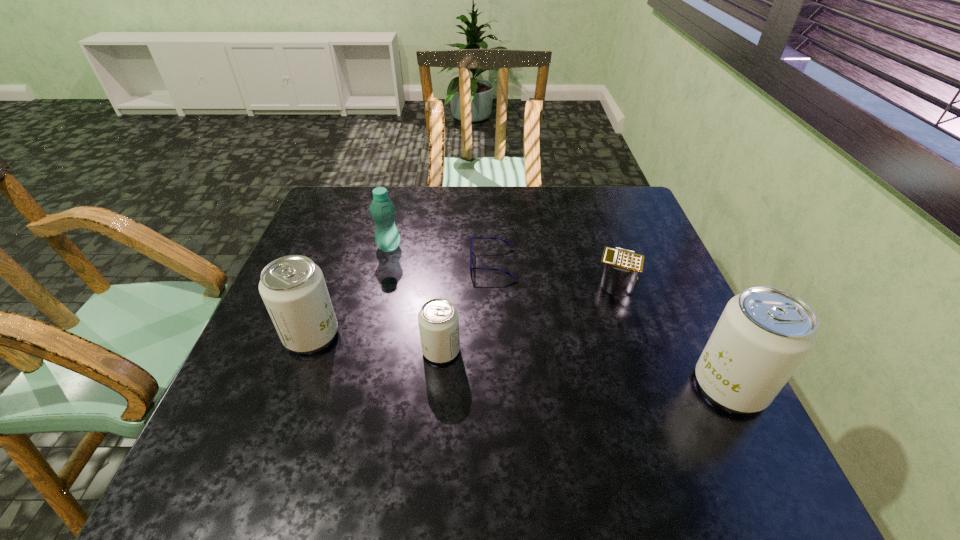
You are a GUI agent. You are given a task and a screenshot of the screen. Output one action in this format:
    pyautogui.click(x=<x>, y=<y>)
    Task: Click on the soda can that can be found as the third closest to the fifth object from right to left
    The height and width of the screenshot is (540, 960).
    Given the screenshot: What is the action you would take?
    point(764,333)

Locate an element on the screen. blank space that satisfies the following two spatial constraints: 1. on the front-facing side of the spectacles; 2. on the front side of the leftmost object is located at coordinates tap(495, 335).

Locate an element on the screen. This screenshot has height=540, width=960. blank area in the image that satisfies the following two spatial constraints: 1. on the back side of the calculator; 2. on the front-facing side of the third object from right to left is located at coordinates (610, 264).

Where is `free location that satisfies the following two spatial constraints: 1. at the front cap of the second soda can from left to right; 2. on the right side of the second object from left to right`? The image size is (960, 540). free location that satisfies the following two spatial constraints: 1. at the front cap of the second soda can from left to right; 2. on the right side of the second object from left to right is located at coordinates (364, 350).

The height and width of the screenshot is (540, 960). Identify the location of blank space that satisfies the following two spatial constraints: 1. on the front-facing side of the shortest object; 2. on the back side of the rightmost object. (497, 386).

I want to click on blank space that satisfies the following two spatial constraints: 1. at the front cap of the water bottle; 2. on the right side of the shortest soda can, so click(x=364, y=350).

Where is `vacant area that satisfies the following two spatial constraints: 1. on the front side of the fifth object from left to right; 2. on the right side of the rightmost soda can`? The image size is (960, 540). vacant area that satisfies the following two spatial constraints: 1. on the front side of the fifth object from left to right; 2. on the right side of the rightmost soda can is located at coordinates (650, 386).